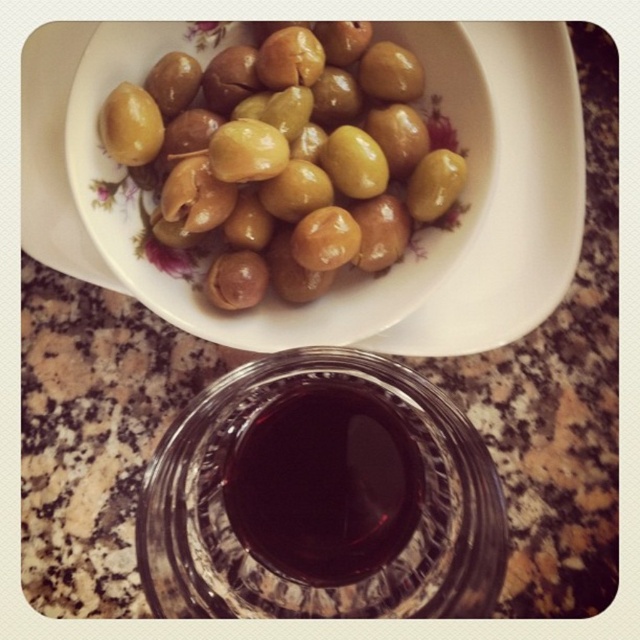
Question: Which object appears farthest from the camera in this image?

Choices:
 (A) dark glass wine at center
 (B) transparent glass bowl at center

Answer: (A)

Question: Does green glossy olives at upper center lie behind dark glass wine at center?

Choices:
 (A) no
 (B) yes

Answer: (B)

Question: Can you confirm if transparent glass bowl at center is smaller than green glossy olives at upper center?

Choices:
 (A) no
 (B) yes

Answer: (B)

Question: Which of these objects is positioned farthest from the green glossy olives at upper center?

Choices:
 (A) transparent glass bowl at center
 (B) dark glass wine at center

Answer: (B)

Question: Is transparent glass bowl at center bigger than dark glass wine at center?

Choices:
 (A) yes
 (B) no

Answer: (A)

Question: Which of the following is the closest to the observer?

Choices:
 (A) (403, 225)
 (B) (349, 568)

Answer: (B)